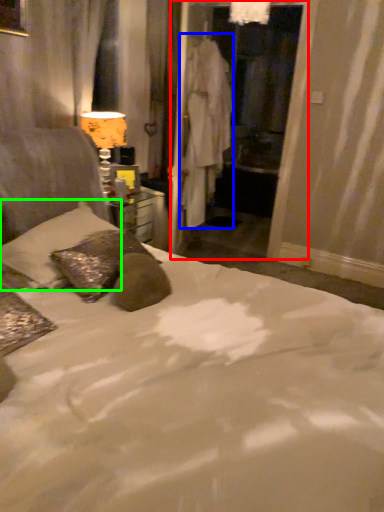
Question: Estimate the real-world distances between objects in this image. Which object is closer to screen door (highlighted by a red box), robe (highlighted by a blue box) or pillow (highlighted by a green box)?

Choices:
 (A) robe
 (B) pillow

Answer: (A)